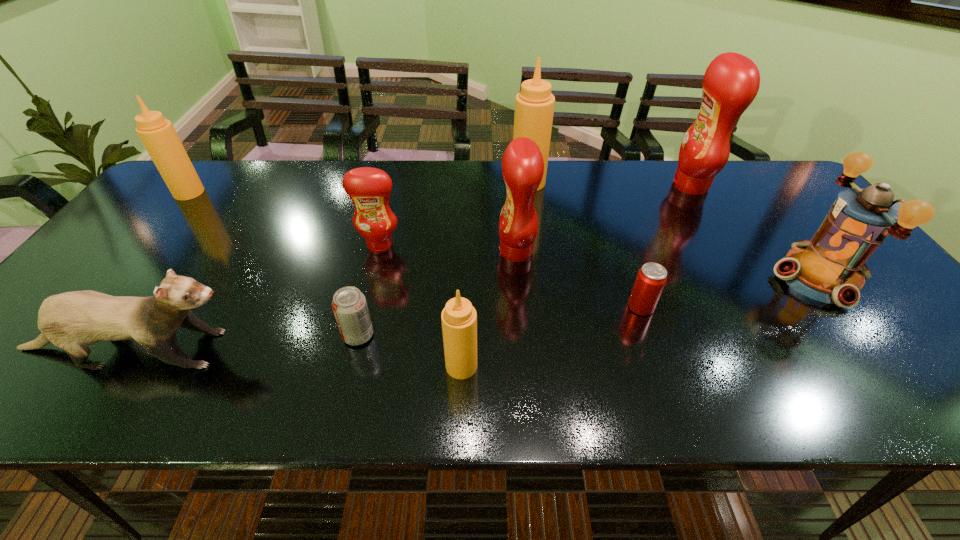
The image size is (960, 540). Find the location of `unoccupied position between the lantern and the gray soda can`. unoccupied position between the lantern and the gray soda can is located at coordinates (588, 306).

Where is `free space between the soda can and the rightmost tan condiment`? The width and height of the screenshot is (960, 540). free space between the soda can and the rightmost tan condiment is located at coordinates [x=444, y=259].

Where is `free space that is in between the biggest tan condiment and the rightmost condiment`? The width and height of the screenshot is (960, 540). free space that is in between the biggest tan condiment and the rightmost condiment is located at coordinates (610, 184).

You are a GUI agent. You are given a task and a screenshot of the screen. Output one action in this format:
    pyautogui.click(x=<x>, y=<y>)
    Task: Click on the object that can be found as the sixth closest to the biggest red condiment
    This screenshot has width=960, height=540.
    Given the screenshot: What is the action you would take?
    pyautogui.click(x=369, y=188)

You are a GUI agent. You are given a task and a screenshot of the screen. Output one action in this format:
    pyautogui.click(x=<x>, y=<y>)
    Task: Click on the fifth closest object to the leftmost red condiment
    The image size is (960, 540).
    Given the screenshot: What is the action you would take?
    pyautogui.click(x=534, y=105)

Where is `condiment that is the third closest to the lantern`? The image size is (960, 540). condiment that is the third closest to the lantern is located at coordinates point(522,164).

Locate an element on the screen. The width and height of the screenshot is (960, 540). the fourth closest condiment relative to the rightmost tan condiment is located at coordinates (459, 318).

Where is `red condiment object that ranks as the second closest to the rightmost red condiment`? red condiment object that ranks as the second closest to the rightmost red condiment is located at coordinates (369, 188).

Identify the location of the closest red condiment relative to the biggest tan condiment. The height and width of the screenshot is (540, 960). (522, 164).

Identify the location of tan condiment that is the closest one to the lantern. Image resolution: width=960 pixels, height=540 pixels. (534, 105).